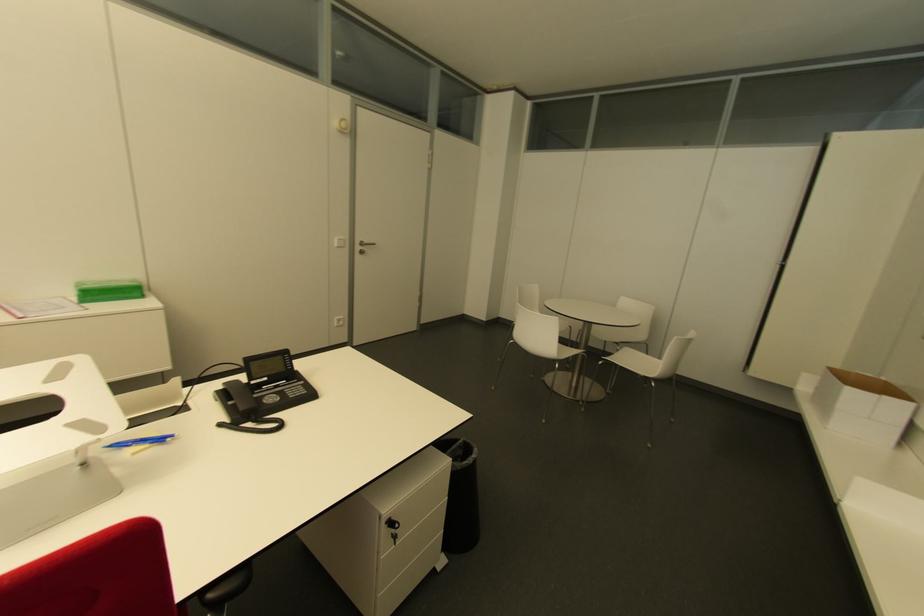
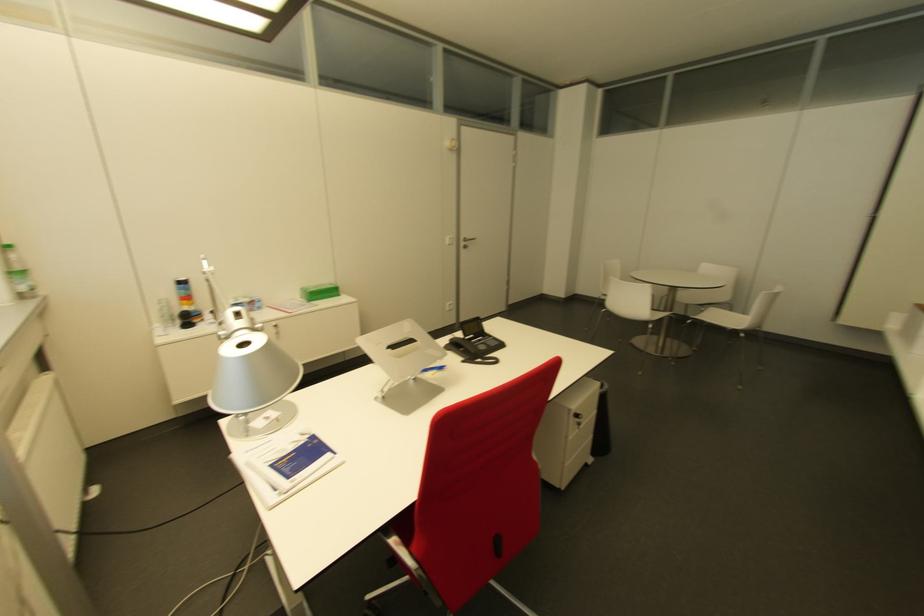
The point at (614,350) is marked in the first image. Where is the corresponding point in the second image?

(700, 310)